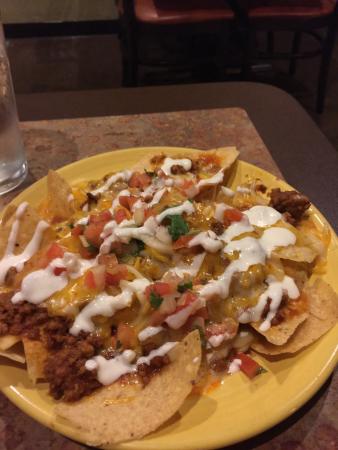
Identify the location of table. (282, 437).